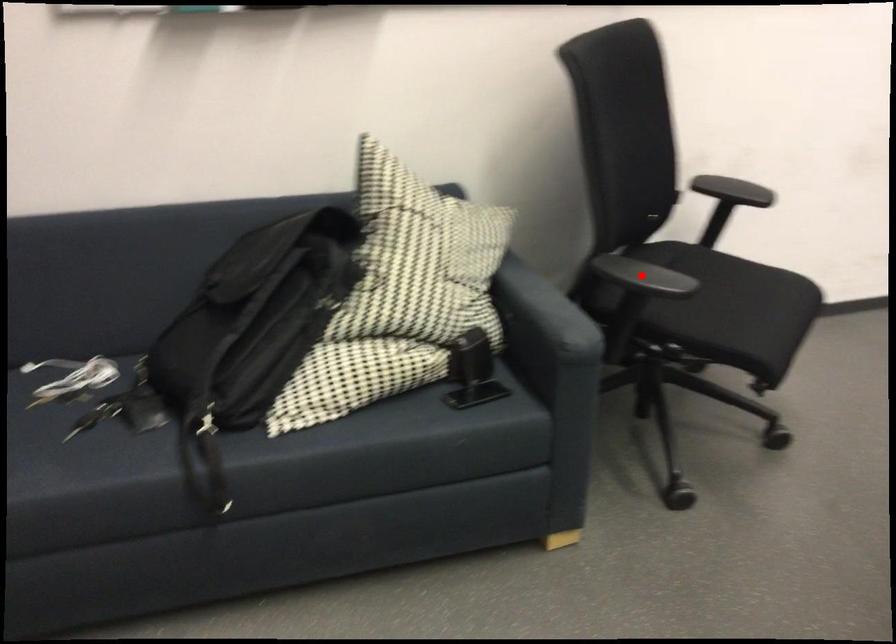
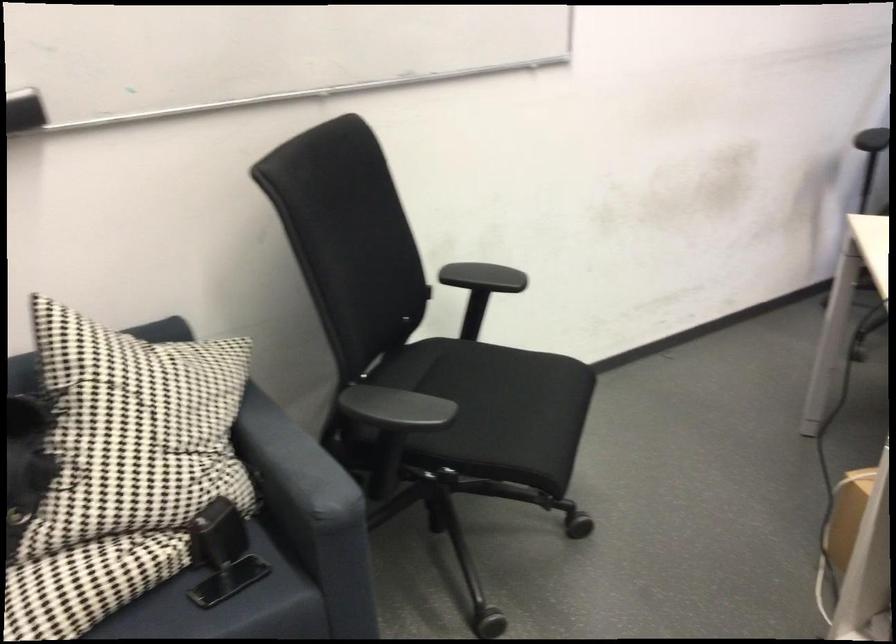
Question: I am providing you with two images of the same scene from different viewpoints. Image1 has a red point marked. In image2, the corresponding 3D location appears at what relative position? Reply with the corresponding letter.

Choices:
 (A) Closer
 (B) Farther

Answer: (A)